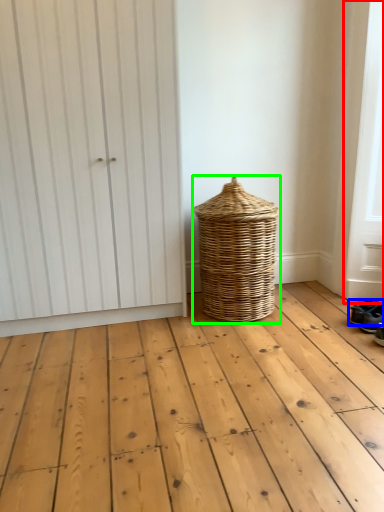
Question: Estimate the real-world distances between objects in this image. Which object is closer to screen door (highlighted by a red box), footwear (highlighted by a blue box) or basket (highlighted by a green box)?

Choices:
 (A) footwear
 (B) basket

Answer: (A)